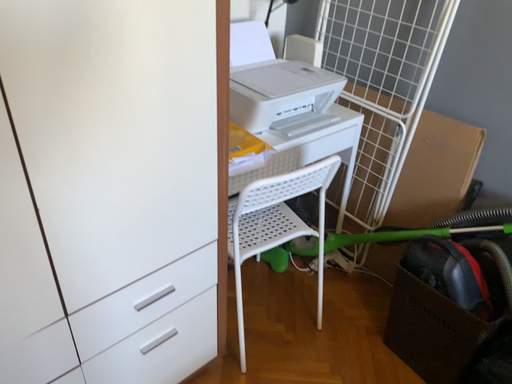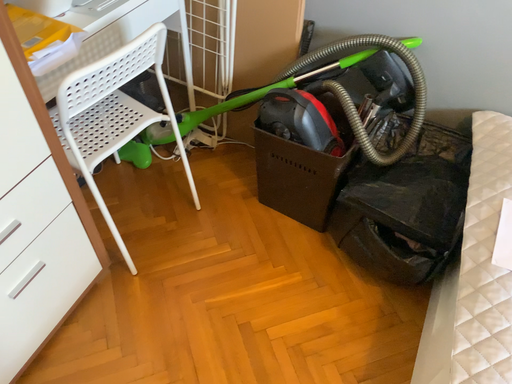
Question: Which way did the camera rotate in the video?

Choices:
 (A) rotated upward
 (B) rotated downward

Answer: (B)